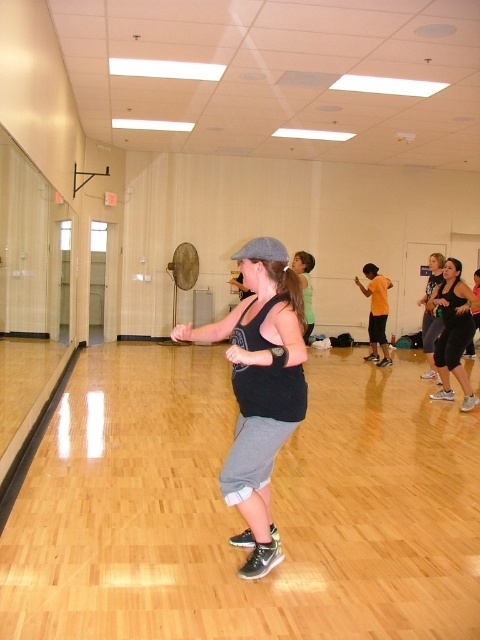
Question: Is black matte tank top at center positioned behind black matte leggings at lower right?

Choices:
 (A) yes
 (B) no

Answer: (B)

Question: Which point is farther from the camera taking this photo?

Choices:
 (A) (467, 291)
 (B) (273, 400)

Answer: (A)

Question: Is black matte tank top at center to the right of black matte leggings at lower right from the viewer's perspective?

Choices:
 (A) yes
 (B) no

Answer: (B)

Question: Among these points, which one is farthest from the camera?

Choices:
 (A) (250, 358)
 (B) (465, 403)

Answer: (B)

Question: Is black matte tank top at center above black matte leggings at lower right?

Choices:
 (A) no
 (B) yes

Answer: (A)